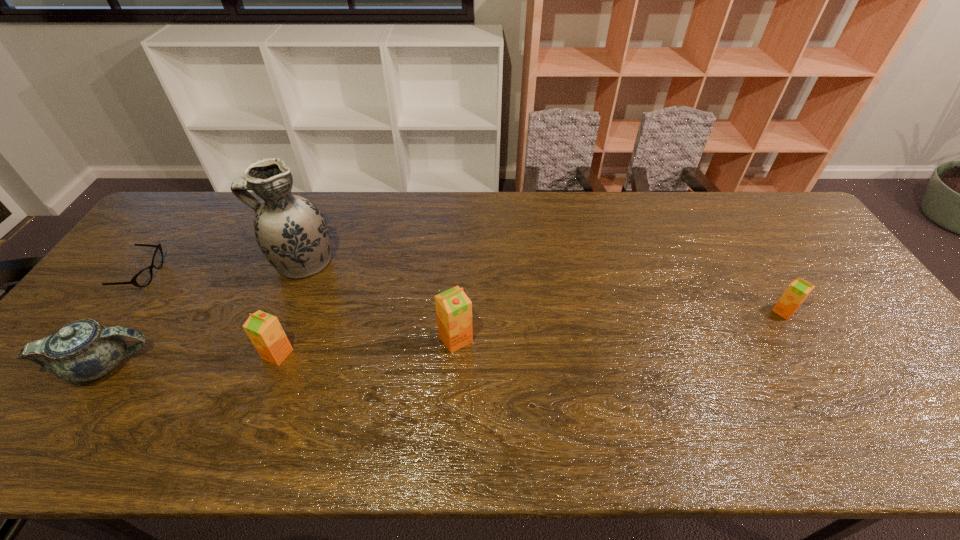
Find the location of a particular element. This screenshot has height=540, width=960. the second tallest orange juice is located at coordinates (264, 330).

Image resolution: width=960 pixels, height=540 pixels. I want to click on the second orange juice from right to left, so click(x=453, y=308).

You are a GUI agent. You are given a task and a screenshot of the screen. Output one action in this format:
    pyautogui.click(x=<x>, y=<y>)
    Task: Click on the fifth shortest object
    The height and width of the screenshot is (540, 960).
    Given the screenshot: What is the action you would take?
    pyautogui.click(x=453, y=308)

The image size is (960, 540). Identify the location of the rightmost object. (796, 293).

The height and width of the screenshot is (540, 960). What are the coordinates of `the second shortest object` in the screenshot? It's located at (796, 293).

You are a GUI agent. You are given a task and a screenshot of the screen. Output one action in this format:
    pyautogui.click(x=<x>, y=<y>)
    Task: Click on the shortest object
    
    Given the screenshot: What is the action you would take?
    pyautogui.click(x=143, y=278)

Image resolution: width=960 pixels, height=540 pixels. Identify the location of chinaware. (84, 350).

Locate an element on the screen. vase is located at coordinates (290, 230).

You are a GUI agent. You are given a task and a screenshot of the screen. Output one action in this format:
    pyautogui.click(x=<x>, y=<y>)
    Task: Click on the free space located on the front of the second tallest orange juice
    The height and width of the screenshot is (540, 960).
    Given the screenshot: What is the action you would take?
    pyautogui.click(x=262, y=396)

The image size is (960, 540). I want to click on free space located 0.370m on the back of the tallest orange juice, so click(x=461, y=234).